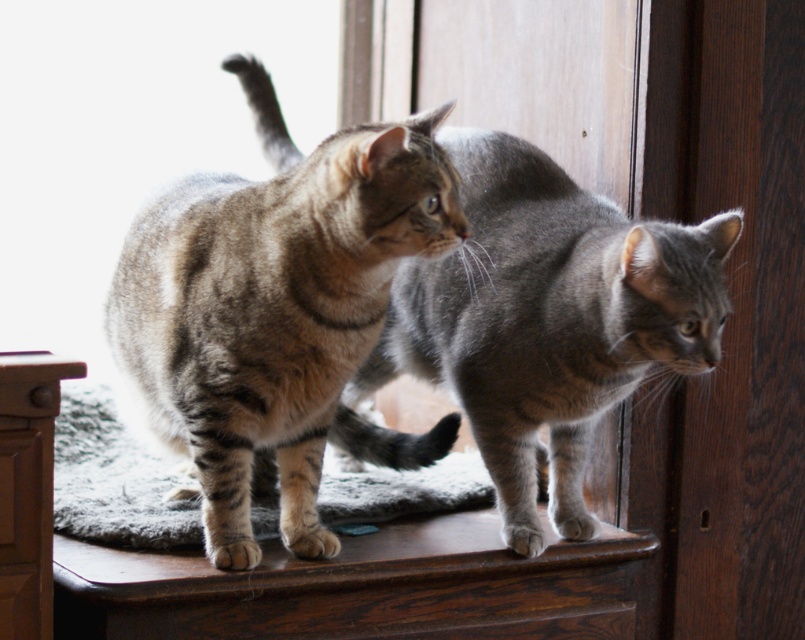
Describe the element at coordinates (279, 317) in the screenshot. The image size is (805, 640). I see `tabby fur cat at center` at that location.

Measure the distance from tabby fur cat at center to gray tabby cat at center.

They are 10.88 inches apart.

Is point (188, 368) farther from camera compared to point (489, 356)?

No, (188, 368) is in front of (489, 356).

Identify the location of tabby fur cat at center. (279, 317).